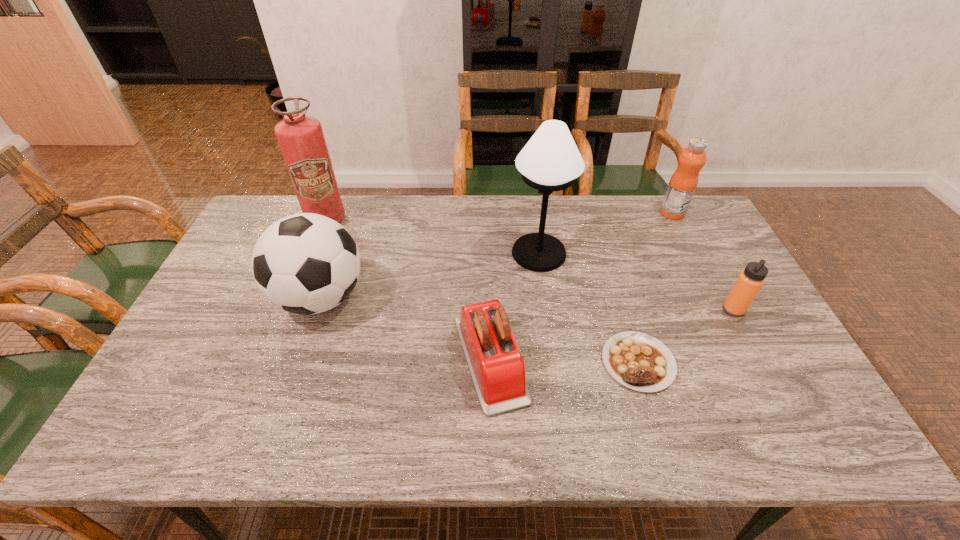
Locate an element on the screen. The image size is (960, 540). thermos bottle positioned at the right edge is located at coordinates (749, 282).

You are a GUI agent. You are given a task and a screenshot of the screen. Output one action in this format:
    pyautogui.click(x=<x>, y=<y>)
    Task: Click on the object situated at the far right corner
    Image resolution: width=960 pixels, height=540 pixels.
    Given the screenshot: What is the action you would take?
    pyautogui.click(x=682, y=185)

This screenshot has width=960, height=540. Find the location of `free region at the far edge`. free region at the far edge is located at coordinates (645, 216).

This screenshot has width=960, height=540. Find the location of `free point at the near edge`. free point at the near edge is located at coordinates (400, 419).

Identify the location of vacant space at the left edge. Image resolution: width=960 pixels, height=540 pixels. (190, 342).

In the image, there is a desktop. Identify the location of vacant space at the far left corner. (273, 205).

What are the coordinates of `vacant space at the far right corner of the desktop` in the screenshot? It's located at (670, 237).

You are a GUI agent. You are given a task and a screenshot of the screen. Output one action in this format:
    pyautogui.click(x=<x>, y=<y>)
    Task: Click on the blank region between the thermos bottle and the soccer ball
    The width and height of the screenshot is (960, 540).
    Given the screenshot: What is the action you would take?
    pyautogui.click(x=527, y=304)

Find the location of `free space between the table lamp and the fruit juice`. free space between the table lamp and the fruit juice is located at coordinates (606, 233).

The height and width of the screenshot is (540, 960). Identify the location of free space between the thermos bottle and the toaster. (612, 335).